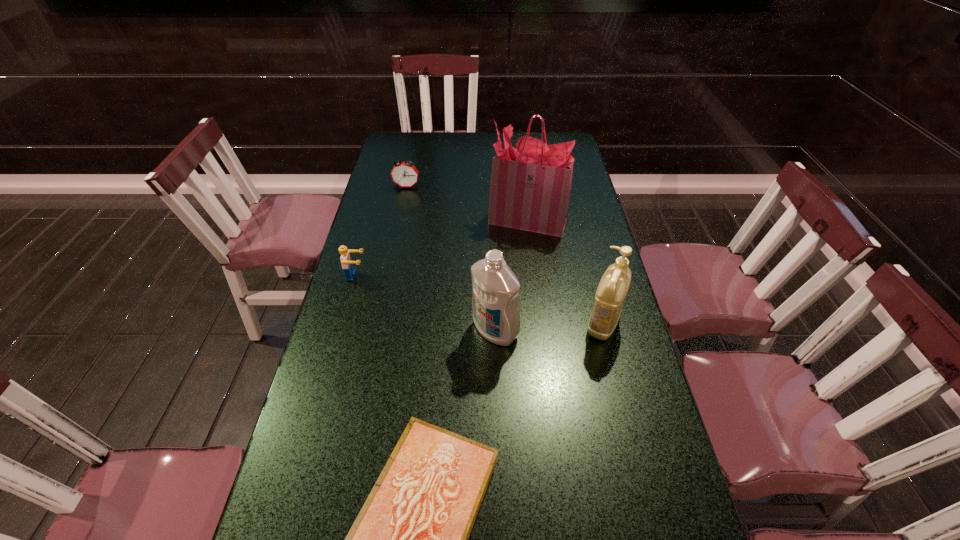
Image resolution: width=960 pixels, height=540 pixels. Find the location of `vacant space that satisfies the following two spatial constraints: 1. on the clock face of the alarm clock; 2. on the right side of the fifth shortest object`. vacant space that satisfies the following two spatial constraints: 1. on the clock face of the alarm clock; 2. on the right side of the fifth shortest object is located at coordinates pos(376,330).

The height and width of the screenshot is (540, 960). Find the location of `vacant space that satisfies the following two spatial constraints: 1. on the clock face of the farthest object; 2. on the left side of the fifth shortest object`. vacant space that satisfies the following two spatial constraints: 1. on the clock face of the farthest object; 2. on the left side of the fifth shortest object is located at coordinates (376, 330).